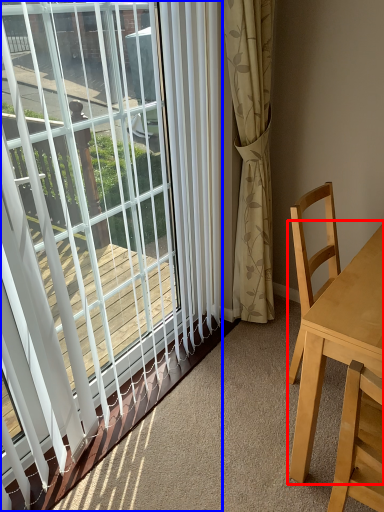
Question: Which object is closer to the camera taking this photo, table (highlighted by a red box) or window (highlighted by a blue box)?

Choices:
 (A) table
 (B) window

Answer: (B)